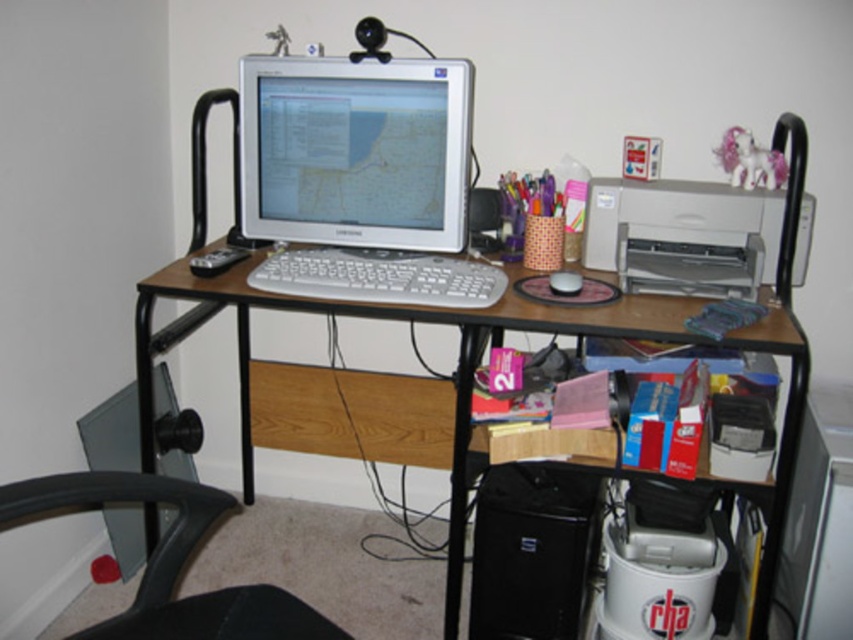
You are standing in front of the desk in the home office. There are two points marked on the desk surface. The first point is at coordinates point (x=788, y=326) and the second is at point (x=556, y=292). Which point is closer to you?

Point (x=788, y=326) is closer to the viewer than point (x=556, y=292).

You are sitting in the black plastic swivel chair at lower left and want to reach the white plastic keyboard at center. Is the keyboard within easy reach for you?

The black plastic swivel chair at lower left has a greater height compared to white plastic keyboard at center, so you may need to lean forward or adjust your posture to comfortably reach the keyboard.

You are organizing your desk and need to place both the white plastic keyboard at center and the white matte mouse at center side by side. Which object requires more horizontal space?

The white plastic keyboard at center requires more horizontal space because its width is larger than the white matte mouse at center.